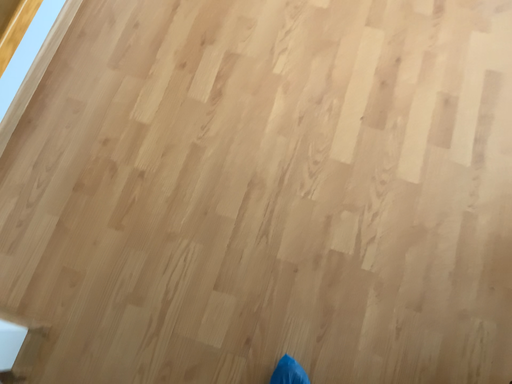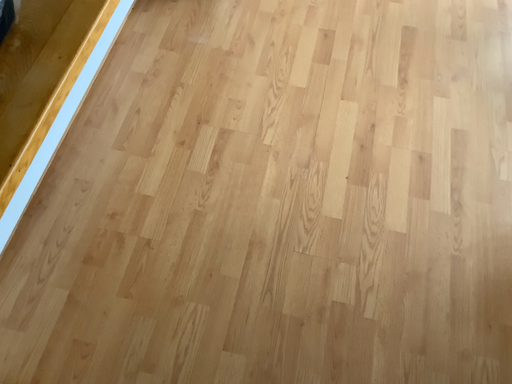
Question: How did the camera likely rotate when shooting the video?

Choices:
 (A) rotated downward
 (B) rotated upward

Answer: (B)